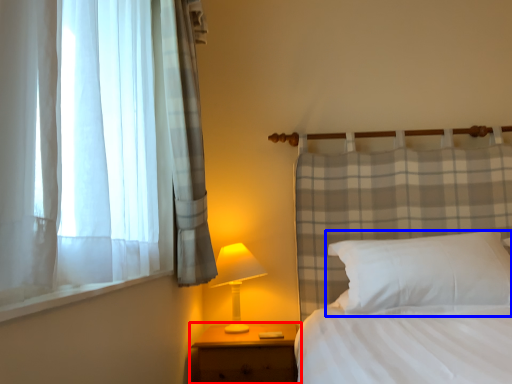
Question: Which object appears closest to the camera in this image, nightstand (highlighted by a red box) or pillow (highlighted by a blue box)?

Choices:
 (A) nightstand
 (B) pillow

Answer: (B)